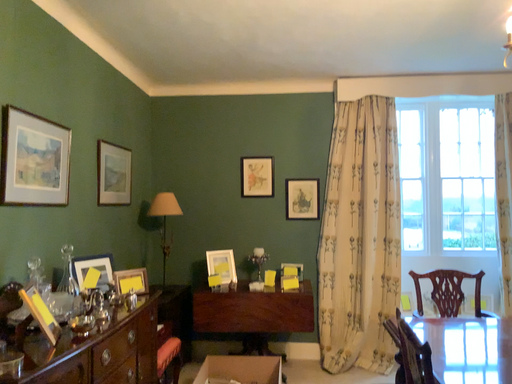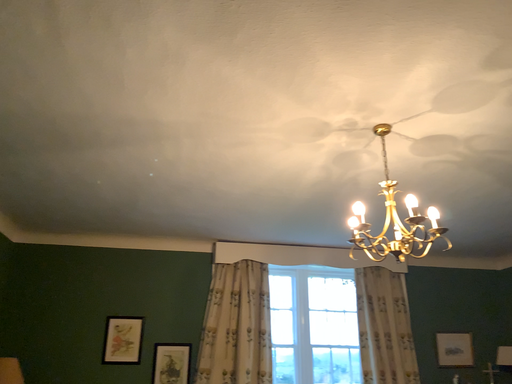
Question: How did the camera likely rotate when shooting the video?

Choices:
 (A) rotated downward
 (B) rotated upward

Answer: (B)